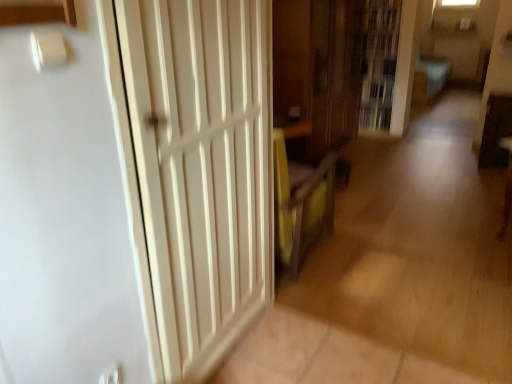
Question: Can we say hardcover book at center, marked as the 2th book in a bottom-to-top arrangement, lies outside wooden bookcase at upper right?

Choices:
 (A) yes
 (B) no

Answer: (B)

Question: Is hardcover book at center, the first book viewed from the top, aimed at wooden bookcase at upper right?

Choices:
 (A) no
 (B) yes

Answer: (B)

Question: Is hardcover book at center, the first book viewed from the top, further to the viewer compared to wooden bookcase at upper right?

Choices:
 (A) yes
 (B) no

Answer: (A)

Question: Considering the relative positions of hardcover book at center, the first book viewed from the top, and wooden bookcase at upper right in the image provided, is hardcover book at center, the first book viewed from the top, in front of wooden bookcase at upper right?

Choices:
 (A) no
 (B) yes

Answer: (A)

Question: Is hardcover book at center, the first book viewed from the top, looking in the opposite direction of wooden bookcase at upper right?

Choices:
 (A) yes
 (B) no

Answer: (A)

Question: Does hardcover book at center, marked as the 2th book in a bottom-to-top arrangement, have a smaller size compared to wooden bookcase at upper right?

Choices:
 (A) no
 (B) yes

Answer: (B)

Question: Is white wood door at left surrounded by wooden cabinet at center?

Choices:
 (A) yes
 (B) no

Answer: (B)

Question: From a real-world perspective, does wooden cabinet at center sit lower than white wood door at left?

Choices:
 (A) yes
 (B) no

Answer: (B)

Question: Is wooden cabinet at center facing away from white wood door at left?

Choices:
 (A) yes
 (B) no

Answer: (B)

Question: Considering the relative positions of wooden cabinet at center and white wood door at left in the image provided, is wooden cabinet at center in front of white wood door at left?

Choices:
 (A) no
 (B) yes

Answer: (A)

Question: Considering the relative positions of wooden cabinet at center and white wood door at left in the image provided, is wooden cabinet at center to the right of white wood door at left from the viewer's perspective?

Choices:
 (A) yes
 (B) no

Answer: (A)

Question: Considering the relative sizes of wooden cabinet at center and white wood door at left in the image provided, is wooden cabinet at center bigger than white wood door at left?

Choices:
 (A) no
 (B) yes

Answer: (B)

Question: Is white wood door at left wider than hardcover book at center, the 2th book positioned from the top?

Choices:
 (A) no
 (B) yes

Answer: (A)